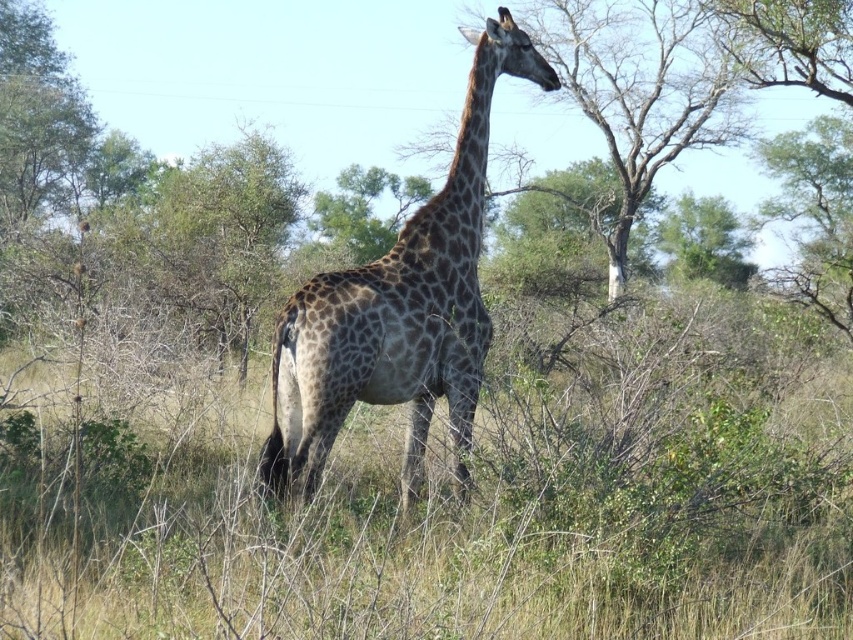
You are a wildlife photographer observing the spotted fur giraffe at center and the brown textured tree at upper center in the savanna. Which object is closer to the camera based on their sizes?

The spotted fur giraffe at center is smaller in size compared to the brown textured tree at upper center, so it is likely closer to the camera since smaller objects can appear closer depending on their actual size and distance.